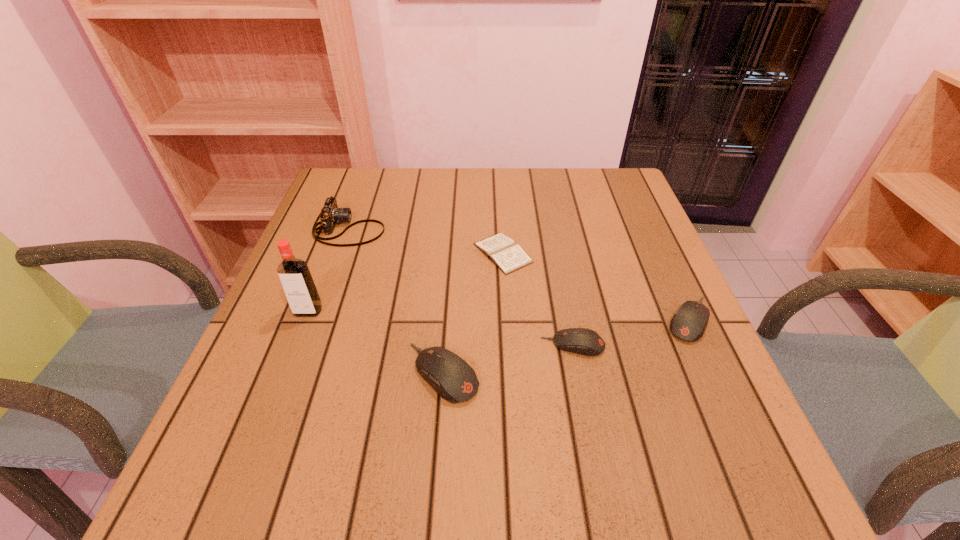
Please point a spot to add another computer mouse on the left. Please provide its 2D coordinates. Your answer should be formatted as a tuple, i.e. [(x, y)], where the tuple contains the x and y coordinates of a point satisfying the conditions above.

[(297, 404)]